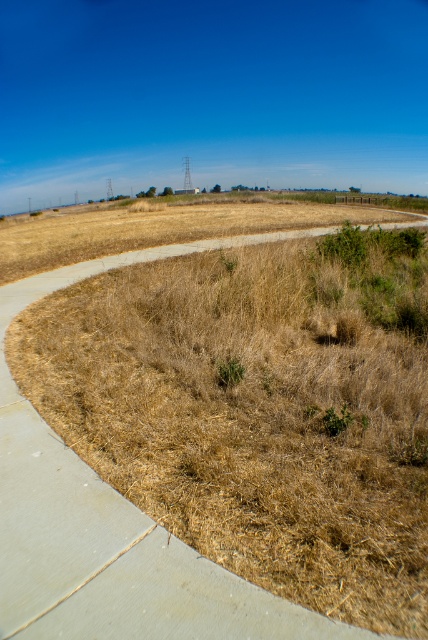
You are standing at the starting point of the curved concrete pathway in the park. You see two points marked on the path ahead of you. Which point is closer to you, point (210, 627) or point (220, 369)?

Point (210, 627) is closer to the viewer than point (220, 369).

You are standing on the curved concrete pathway in the park. You see brown dry grass at center and green leafy weed at center. Which one is located to the left side of the other?

The brown dry grass at center is to the left of the green leafy weed at center.

You are standing on the curved concrete pathway in the park and see both the brown dry grass at center and the green leafy weed at center. Which one is closer to you?

The brown dry grass at center is closer to you because it is in front of the green leafy weed at center.